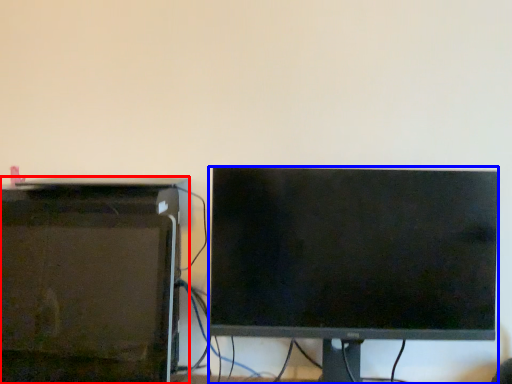
Question: Which of the following is the closest to the observer, desktop computer (highlighted by a red box) or computer monitor (highlighted by a blue box)?

Choices:
 (A) desktop computer
 (B) computer monitor

Answer: (A)